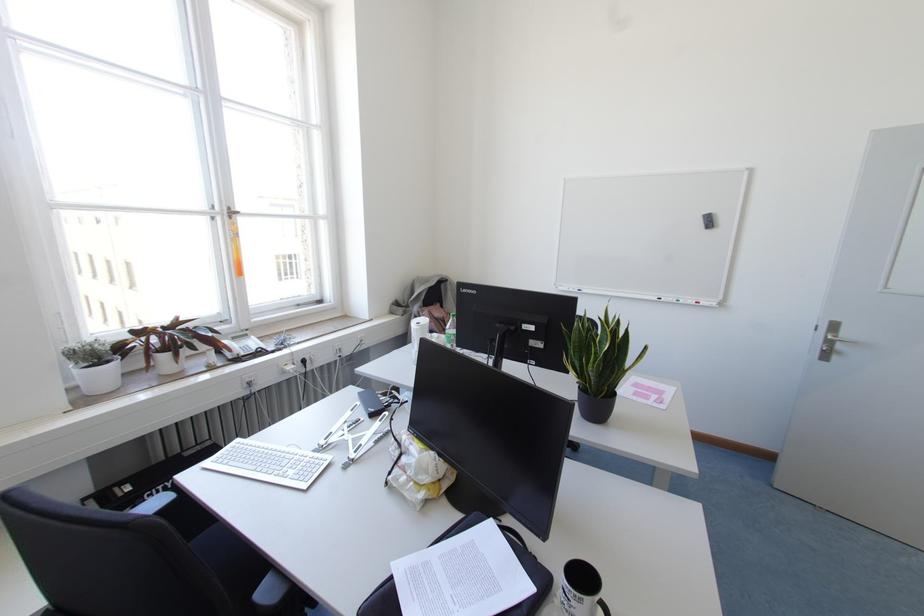
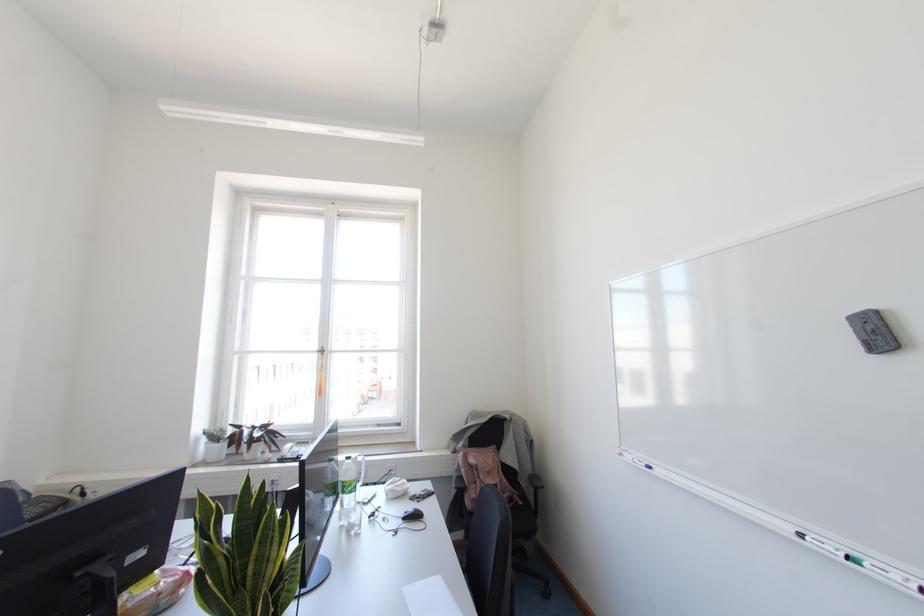
The point at (104, 344) is marked in the first image. Where is the corresponding point in the second image?

(223, 431)